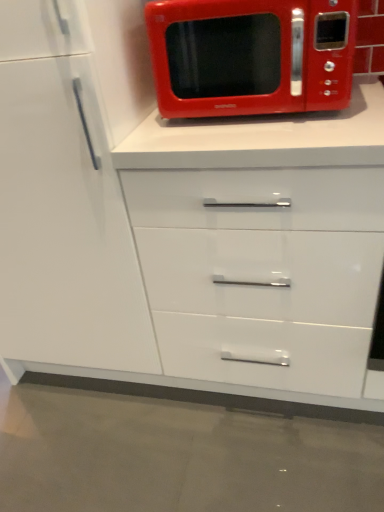
Question: Can white glossy cabinet at lower left be found inside shiny red microwave at upper center?

Choices:
 (A) no
 (B) yes

Answer: (A)

Question: From the image's perspective, is shiny red microwave at upper center beneath white glossy cabinet at lower left?

Choices:
 (A) yes
 (B) no

Answer: (B)

Question: From a real-world perspective, is shiny red microwave at upper center located beneath white glossy cabinet at lower left?

Choices:
 (A) yes
 (B) no

Answer: (B)

Question: Can you confirm if shiny red microwave at upper center is shorter than white glossy cabinet at lower left?

Choices:
 (A) yes
 (B) no

Answer: (A)

Question: Is shiny red microwave at upper center further to the viewer compared to white glossy cabinet at lower left?

Choices:
 (A) yes
 (B) no

Answer: (A)

Question: Considering the relative positions of shiny red microwave at upper center and white glossy cabinet at lower left in the image provided, is shiny red microwave at upper center in front of white glossy cabinet at lower left?

Choices:
 (A) no
 (B) yes

Answer: (A)

Question: Can you confirm if white glossy cabinet at lower left is bigger than shiny red microwave at upper center?

Choices:
 (A) no
 (B) yes

Answer: (B)

Question: Does white glossy cabinet at lower left have a lesser width compared to shiny red microwave at upper center?

Choices:
 (A) no
 (B) yes

Answer: (A)

Question: From the image's perspective, is white glossy cabinet at lower left under shiny red microwave at upper center?

Choices:
 (A) yes
 (B) no

Answer: (A)

Question: Does white glossy cabinet at lower left lie in front of shiny red microwave at upper center?

Choices:
 (A) yes
 (B) no

Answer: (A)

Question: Is white glossy cabinet at lower left looking in the opposite direction of shiny red microwave at upper center?

Choices:
 (A) yes
 (B) no

Answer: (B)

Question: Is white glossy cabinet at lower left facing towards shiny red microwave at upper center?

Choices:
 (A) no
 (B) yes

Answer: (A)

Question: Is white glossy cabinet at lower left inside the boundaries of shiny red microwave at upper center, or outside?

Choices:
 (A) outside
 (B) inside

Answer: (A)